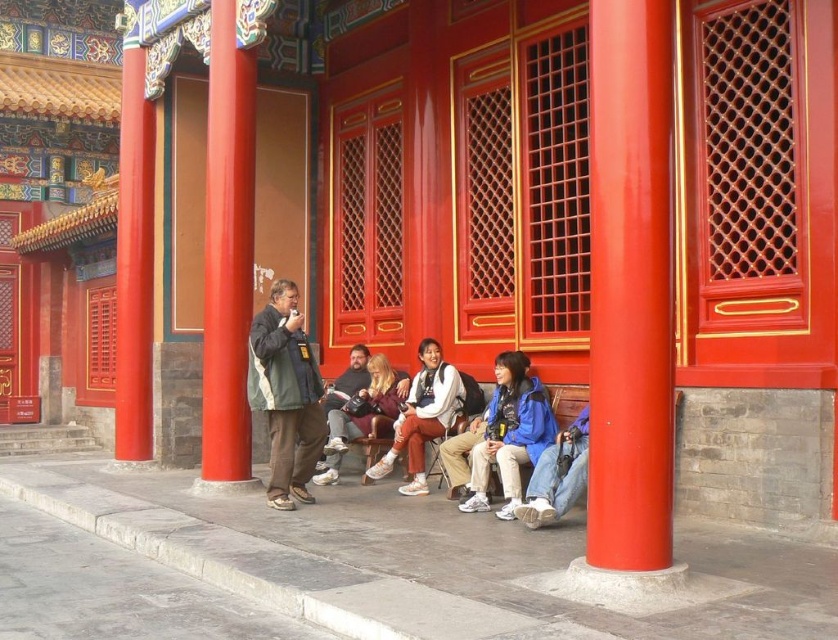
From the picture: You are standing in front of the traditional Chinese building and want to take a photo of the smooth red pillar at upper left and the brown leather jacket at left. To ensure both are in the frame, which object should you position closer to the center of your camera viewfinder?

You should position the brown leather jacket at left closer to the center of your camera viewfinder because the smooth red pillar at upper left is to the left of the brown leather jacket at left, so centering the jacket will keep both in the frame.

You are a photographer standing in front of the traditional Chinese building. You want to take a photo that includes both the glossy red pillar at center and the white leather sneakers at center. Which object should you adjust your camera angle to focus on first to ensure both are in frame?

The glossy red pillar at center is in front of the white leather sneakers at center, so you should focus on the glossy red pillar at center first to ensure both are visible in the frame.